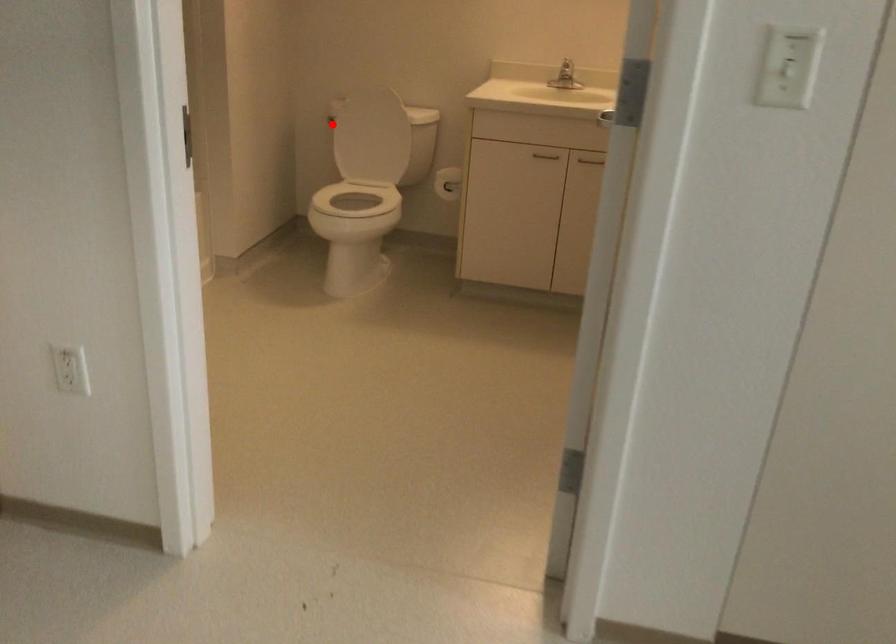
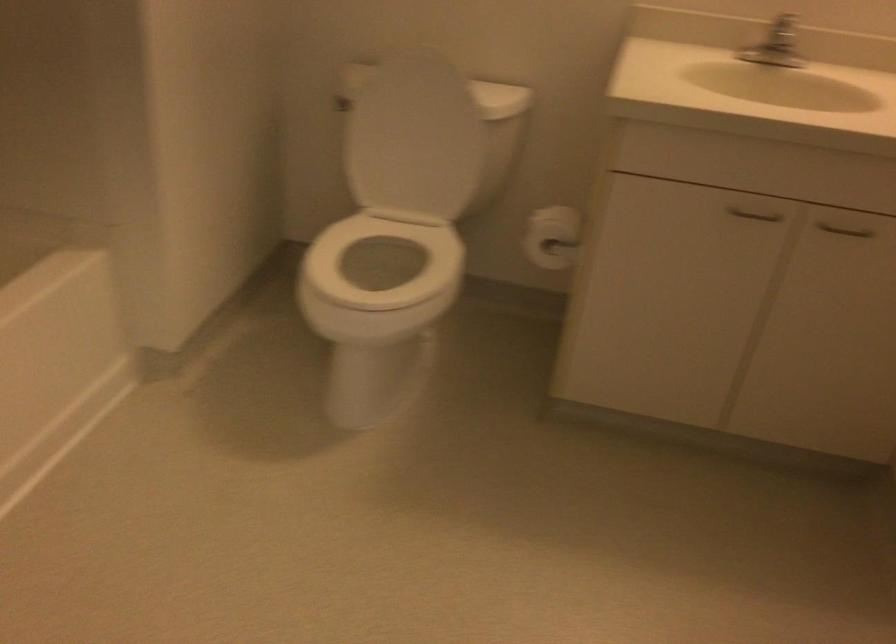
Question: I am providing you with two images of the same scene from different viewpoints. A red point is shown in image1. For the corresponding object point in image2, is it positioned nearer or farther from the camera?

Choices:
 (A) Nearer
 (B) Farther

Answer: (A)